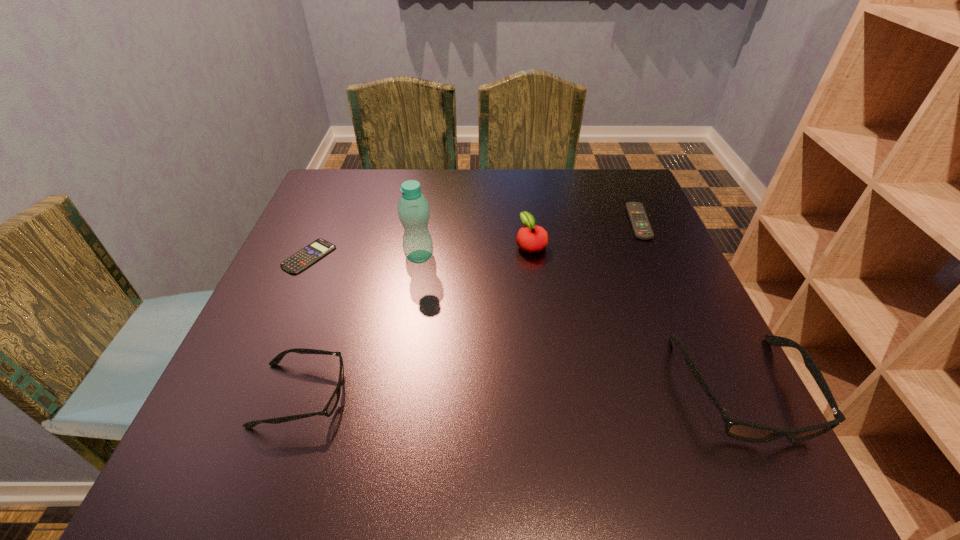
Where is `vacant space that is in between the right spectacles and the second shortest object`? The image size is (960, 540). vacant space that is in between the right spectacles and the second shortest object is located at coordinates (690, 305).

Where is `empty space between the fourth tallest object and the apple`? This screenshot has width=960, height=540. empty space between the fourth tallest object and the apple is located at coordinates (416, 320).

Find the location of `free space that is in between the taller spectacles and the calculator`. free space that is in between the taller spectacles and the calculator is located at coordinates (526, 322).

The height and width of the screenshot is (540, 960). In order to click on blank region between the left spectacles and the taller spectacles in this screenshot , I will do `click(522, 392)`.

The image size is (960, 540). I want to click on free space between the shorter spectacles and the right spectacles, so click(x=522, y=392).

Identify which object is the second closest to the right spectacles. Please provide its 2D coordinates. Your answer should be formatted as a tuple, i.e. [(x, y)], where the tuple contains the x and y coordinates of a point satisfying the conditions above.

[(531, 238)]

Locate an element on the screen. object that ranks as the fifth closest to the remote control is located at coordinates (305, 257).

This screenshot has height=540, width=960. In order to click on vacant region that satisfies the following two spatial constraints: 1. on the back side of the fifth tallest object; 2. on the right side of the shortest object in this screenshot , I will do `click(324, 222)`.

Identify the location of free space that satisfies the following two spatial constraints: 1. on the front side of the third object from right to left; 2. on the front-facing side of the shorter spectacles. The width and height of the screenshot is (960, 540). (551, 395).

This screenshot has height=540, width=960. Identify the location of free space that satisfies the following two spatial constraints: 1. on the front side of the fourth object from left to right; 2. on the front-facing side of the left spectacles. (551, 395).